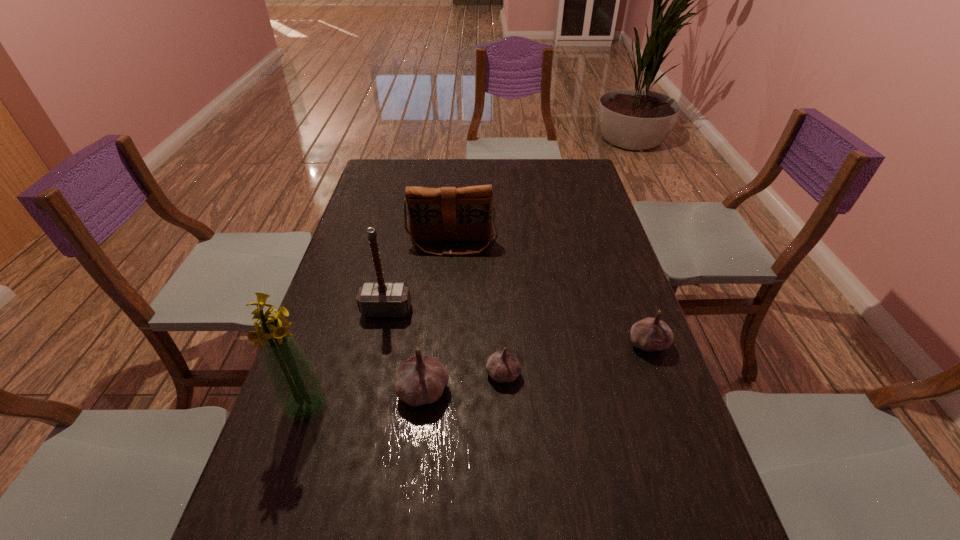
Find the location of a particular element. The height and width of the screenshot is (540, 960). bouquet is located at coordinates (298, 389).

Where is `the leftmost object`? The height and width of the screenshot is (540, 960). the leftmost object is located at coordinates [x=298, y=389].

This screenshot has width=960, height=540. I want to click on vacant space located 0.110m on the back of the leftmost garlic, so click(429, 335).

Image resolution: width=960 pixels, height=540 pixels. I want to click on vacant region located 0.160m on the right of the second garlic from left to right, so click(x=586, y=374).

Find the location of a particular element. vacant space located on the back of the rightmost garlic is located at coordinates (627, 284).

Where is `vacant region located 0.310m on the front-facing side of the shoulder bag`? Image resolution: width=960 pixels, height=540 pixels. vacant region located 0.310m on the front-facing side of the shoulder bag is located at coordinates pos(446,330).

Find the location of a particular element. The height and width of the screenshot is (540, 960). vacant region located 0.180m on the striking surface of the hammer is located at coordinates (372, 374).

At what (x,y) coordinates should I click in order to perform the action: click on blank space located 0.120m on the front-facing side of the bouquet. Please return your answer as a coordinate pair (x, y). Looking at the image, I should click on (282, 478).

Where is `hammer located in the left edge section of the desktop`? hammer located in the left edge section of the desktop is located at coordinates (375, 299).

The image size is (960, 540). What are the coordinates of `bouquet that is at the left edge` in the screenshot? It's located at (298, 389).